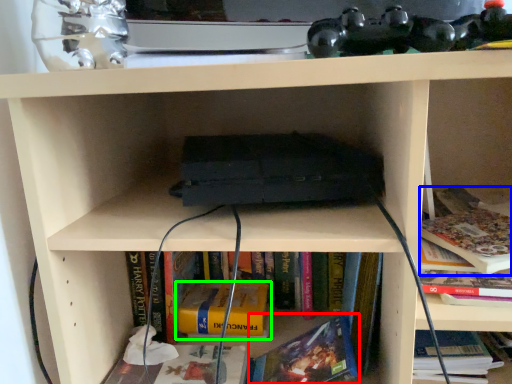
Question: Estimate the real-world distances between objects in this image. Which object is farther from book (highlighted by a red box), book (highlighted by a blue box) or book (highlighted by a green box)?

Choices:
 (A) book
 (B) book

Answer: (A)